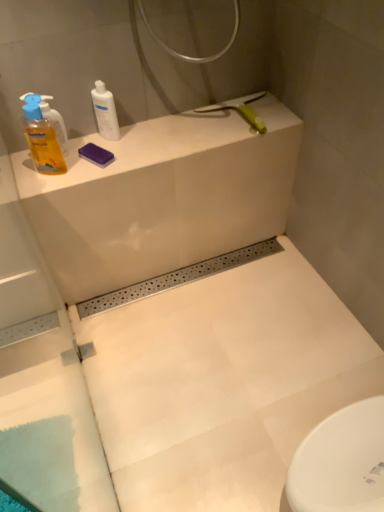
At what (x,y) coordinates should I click in order to perform the action: click on vacant space that is to the left of yellow translucent liquid at left, which is the 1th cleaning product in left-to-right order. Please return your answer as a coordinate pair (x, y). Looking at the image, I should click on (24, 170).